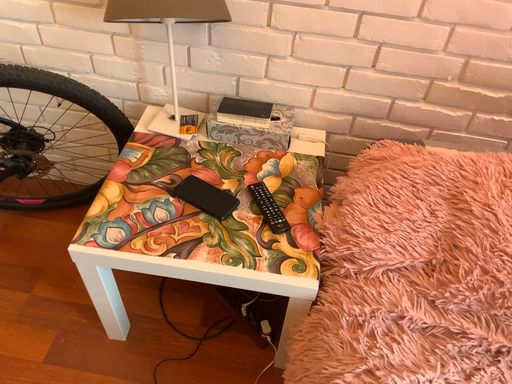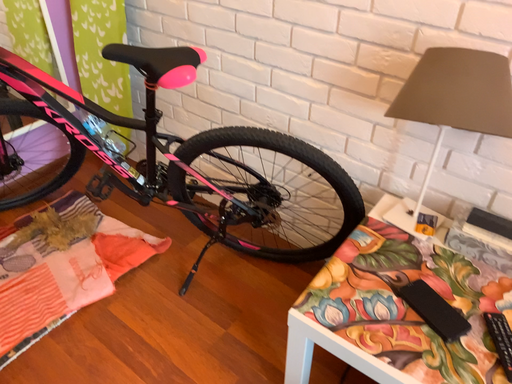
Question: Which way did the camera rotate in the video?

Choices:
 (A) rotated left
 (B) rotated right

Answer: (A)